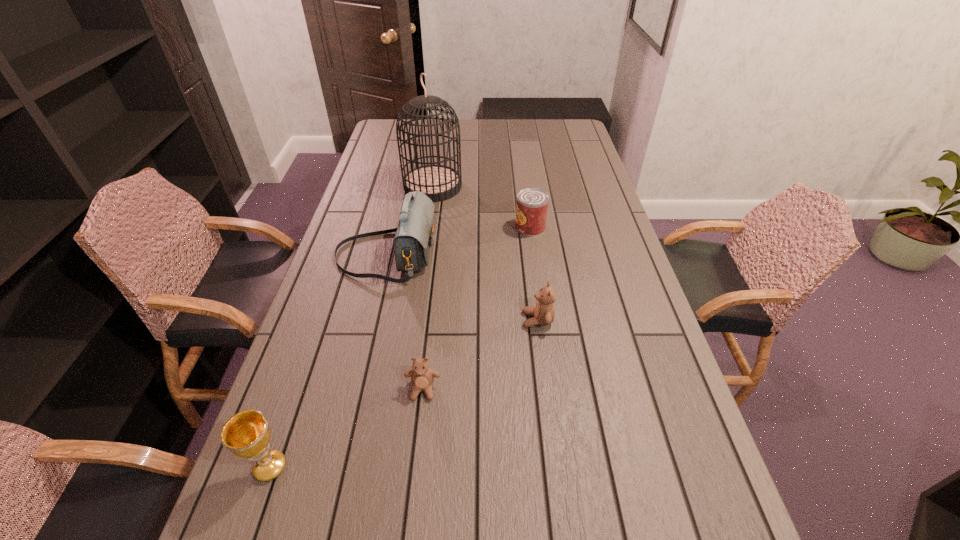
Image resolution: width=960 pixels, height=540 pixels. I want to click on empty space that is in between the nearest object and the tallest object, so click(351, 327).

You are a GUI agent. You are given a task and a screenshot of the screen. Output one action in this format:
    pyautogui.click(x=<x>, y=<y>)
    Task: Click on the vacant space that's between the farther teddy bear and the fourth shortest object
    The width and height of the screenshot is (960, 540).
    Given the screenshot: What is the action you would take?
    pyautogui.click(x=404, y=394)

I want to click on vacant area that lies between the fifth farthest object and the nearest object, so click(x=347, y=428).

You are a GUI agent. You are given a task and a screenshot of the screen. Output one action in this format:
    pyautogui.click(x=<x>, y=<y>)
    Task: Click on the free spot between the farthest object and the third nearest object
    The height and width of the screenshot is (540, 960).
    Given the screenshot: What is the action you would take?
    pyautogui.click(x=485, y=253)

At what (x,y) coordinates should I click in order to perform the action: click on unoccupied area between the tallest object and the left teddy bear. Please return your answer as a coordinate pair (x, y). Looking at the image, I should click on (428, 288).

Choose which object is the third nearest neighbor to the third nearest object. Please provide its 2D coordinates. Your answer should be formatted as a tuple, i.e. [(x, y)], where the tuple contains the x and y coordinates of a point satisfying the conditions above.

[(532, 203)]

Where is `object that can be found as the second closest to the taller teddy bear`? The width and height of the screenshot is (960, 540). object that can be found as the second closest to the taller teddy bear is located at coordinates (413, 239).

You are a GUI agent. You are given a task and a screenshot of the screen. Output one action in this format:
    pyautogui.click(x=<x>, y=<y>)
    Task: Click on the free space that satisfies the following two spatial constraints: 1. on the back side of the can; 2. on the left side of the shoulder bag
    
    Given the screenshot: What is the action you would take?
    pyautogui.click(x=393, y=228)

Where is `vacant region that satisfies the following two spatial constraints: 1. on the back side of the can; 2. on the left side of the nearest object`? vacant region that satisfies the following two spatial constraints: 1. on the back side of the can; 2. on the left side of the nearest object is located at coordinates (353, 228).